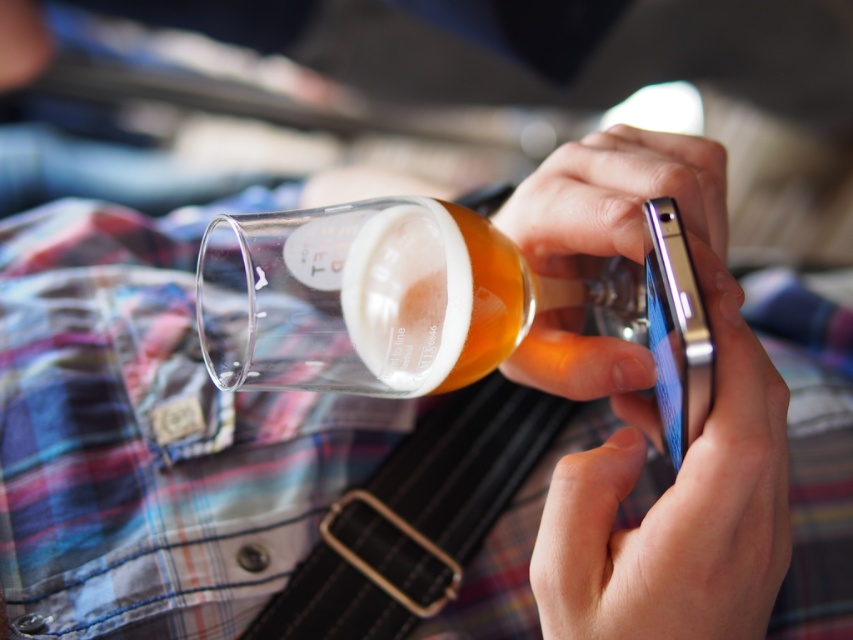
Based on the photo, which is above, metallic silver phone at center or transparent glass at center?

transparent glass at center is higher up.

Is point (621, 236) positioned before point (492, 236)?

Yes, it is.

Is point (656, 506) behind point (204, 243)?

No, (656, 506) is in front of (204, 243).

Locate an element on the screen. This screenshot has width=853, height=640. metallic silver phone at center is located at coordinates (671, 484).